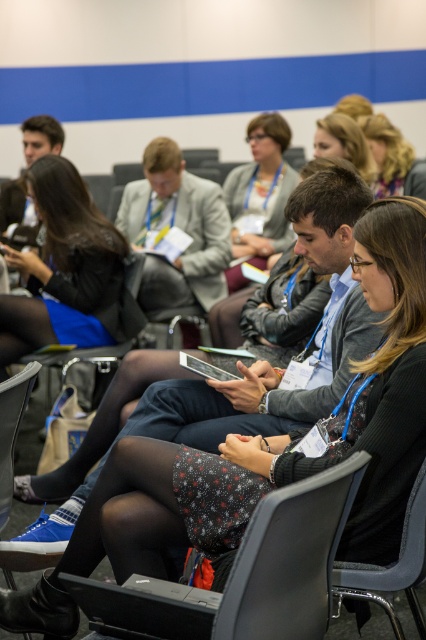
Can you confirm if black fabric skirt at center is positioned to the right of black plastic chair at center?

Incorrect, black fabric skirt at center is not on the right side of black plastic chair at center.

Which of these two, black fabric skirt at center or black plastic chair at center, stands taller?

Standing taller between the two is black fabric skirt at center.

Describe the element at coordinates (63, 266) in the screenshot. I see `black fabric skirt at center` at that location.

Where is `black fabric skirt at center`? black fabric skirt at center is located at coordinates (63, 266).

Between floral-patterned fabric skirt at center and black fabric chair at lower right, which one has less height?

Standing shorter between the two is black fabric chair at lower right.

Is floral-patterned fabric skirt at center taller than black fabric chair at lower right?

Yes.

Where is `floral-patterned fabric skirt at center`? The image size is (426, 640). floral-patterned fabric skirt at center is located at coordinates (264, 452).

Is point (89, 536) closer to camera compared to point (259, 180)?

Yes, it is in front of point (259, 180).

Can you confirm if black plastic chair at center is wider than matte black jacket at center?

No, black plastic chair at center is not wider than matte black jacket at center.

Find the location of a particular element. The image size is (426, 640). black plastic chair at center is located at coordinates (129, 518).

The image size is (426, 640). I want to click on black plastic chair at center, so pyautogui.click(x=129, y=518).